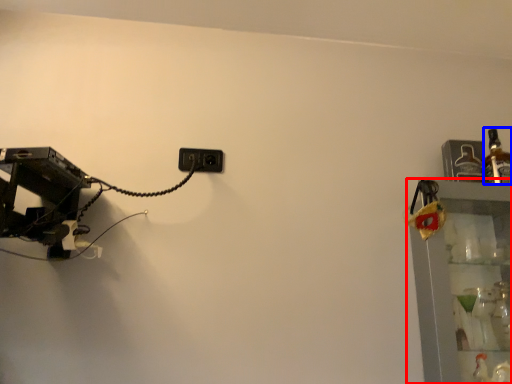
Question: Which of the following is the closest to the observer, shelf (highlighted by a red box) or bottle (highlighted by a blue box)?

Choices:
 (A) shelf
 (B) bottle

Answer: (A)